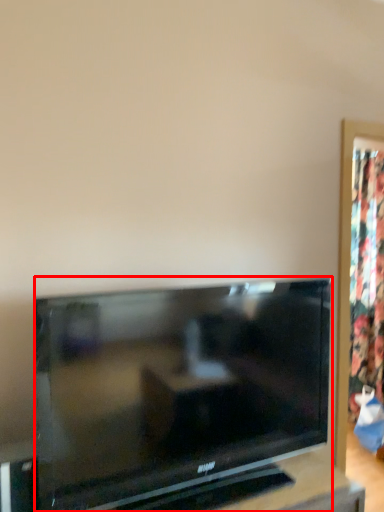
Question: From the image's perspective, considering the relative positions of television (annotated by the red box) and curtain in the image provided, where is television (annotated by the red box) located with respect to the staircase?

Choices:
 (A) below
 (B) above

Answer: (A)